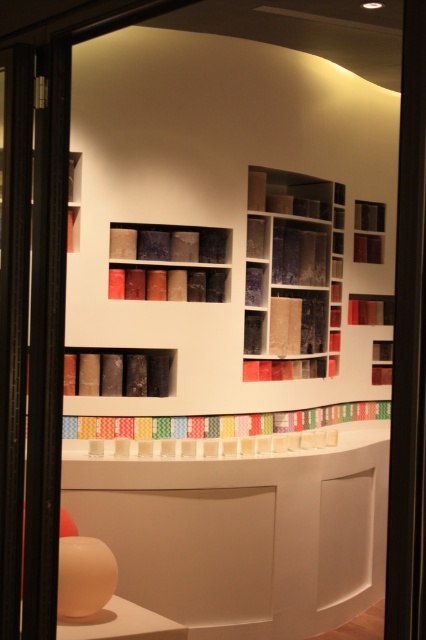
You are standing in the showroom and want to reach the point marked at coordinates point (313, 296). If you can move forward in 1.2 meter increments, how many steps will it take you to reach that point?

The distance between you and point (313, 296) is 4.78 meters. Since you move in 1.2 meter increments, dividing 4.78 by 1.2 gives approximately 4 steps. However, since you can only take whole steps, you would need 4 full steps to cover 4.8 meters, which is slightly beyond the required distance. Alternatively, rounding up, it would take 4 steps to reach or surpass the point.

You are a customer in a showroom and want to see the samples behind the transparent glass door at left. However, the textured fabric at center is blocking your view. Can you move the fabric to get a clear view?

The textured fabric at center is positioned over the transparent glass door at left, so moving it would allow you to see the samples behind the door clearly.

You are standing in the showroom and want to move from the entrance to the matte black bookshelf at center. Which direction should you move relative to the transparent glass door at left?

The transparent glass door at left is to the left of the matte black bookshelf at center. Therefore, to reach the matte black bookshelf at center from the entrance, you should move to the right of the transparent glass door at left.